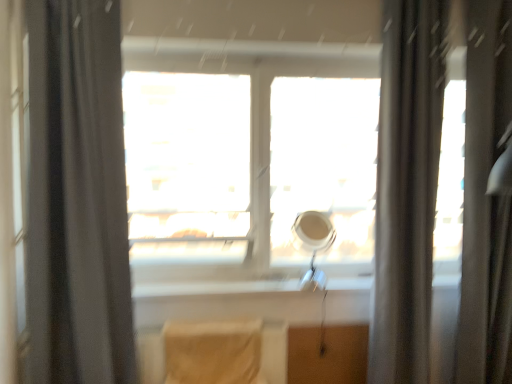
Question: From a real-world perspective, is matte gray curtain at right, the 1th curtain when ordered from right to left, under transparent glass window at center?

Choices:
 (A) yes
 (B) no

Answer: (A)

Question: From the image's perspective, is matte gray curtain at right, the 1th curtain when ordered from right to left, located above transparent glass window at center?

Choices:
 (A) no
 (B) yes

Answer: (A)

Question: Is matte gray curtain at right, the 1th curtain when ordered from right to left, not close to transparent glass window at center?

Choices:
 (A) no
 (B) yes

Answer: (A)

Question: Does matte gray curtain at right, the 1th curtain when ordered from right to left, turn towards transparent glass window at center?

Choices:
 (A) no
 (B) yes

Answer: (A)

Question: From a real-world perspective, is matte gray curtain at right, which appears as the 2th curtain when viewed from the left, physically above transparent glass window at center?

Choices:
 (A) no
 (B) yes

Answer: (A)

Question: Does point (81, 145) appear closer or farther from the camera than point (163, 268)?

Choices:
 (A) farther
 (B) closer

Answer: (B)

Question: Choose the correct answer: Is black fabric curtain at left, placed as the 2th curtain when sorted from right to left, inside transparent glass window at center or outside it?

Choices:
 (A) outside
 (B) inside

Answer: (A)

Question: Considering the positions of black fabric curtain at left, placed as the 2th curtain when sorted from right to left, and transparent glass window at center in the image, is black fabric curtain at left, placed as the 2th curtain when sorted from right to left, taller or shorter than transparent glass window at center?

Choices:
 (A) short
 (B) tall

Answer: (B)

Question: Considering the positions of black fabric curtain at left, which is the 1th curtain in left-to-right order, and transparent glass window at center in the image, is black fabric curtain at left, which is the 1th curtain in left-to-right order, wider or thinner than transparent glass window at center?

Choices:
 (A) thin
 (B) wide

Answer: (B)

Question: Considering the positions of matte gray curtain at right, which appears as the 2th curtain when viewed from the left, and black fabric curtain at left, placed as the 2th curtain when sorted from right to left, in the image, is matte gray curtain at right, which appears as the 2th curtain when viewed from the left, taller or shorter than black fabric curtain at left, placed as the 2th curtain when sorted from right to left,?

Choices:
 (A) tall
 (B) short

Answer: (A)

Question: Considering the positions of point (485, 201) and point (122, 203), is point (485, 201) closer or farther from the camera than point (122, 203)?

Choices:
 (A) closer
 (B) farther

Answer: (B)

Question: In terms of size, does matte gray curtain at right, which appears as the 2th curtain when viewed from the left, appear bigger or smaller than black fabric curtain at left, placed as the 2th curtain when sorted from right to left?

Choices:
 (A) big
 (B) small

Answer: (A)

Question: Is matte gray curtain at right, which appears as the 2th curtain when viewed from the left, spatially inside black fabric curtain at left, placed as the 2th curtain when sorted from right to left, or outside of it?

Choices:
 (A) inside
 (B) outside

Answer: (B)

Question: Is silky gray shower curtain at right bigger or smaller than black fabric curtain at left, placed as the 2th curtain when sorted from right to left?

Choices:
 (A) big
 (B) small

Answer: (B)

Question: Is silky gray shower curtain at right taller or shorter than black fabric curtain at left, placed as the 2th curtain when sorted from right to left?

Choices:
 (A) short
 (B) tall

Answer: (B)